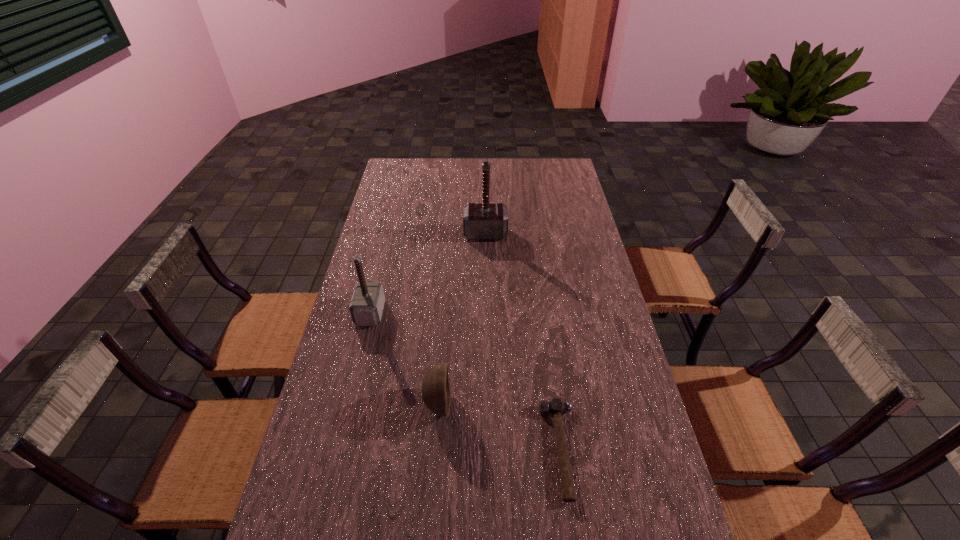
Image resolution: width=960 pixels, height=540 pixels. I want to click on hammer that is the second nearest to the shortest hammer, so click(483, 221).

Point out which hammer is positioned as the nearest to the third object from right to left. Please provide its 2D coordinates. Your answer should be formatted as a tuple, i.e. [(x, y)], where the tuple contains the x and y coordinates of a point satisfying the conditions above.

[(556, 407)]

At what (x,y) coordinates should I click in order to perform the action: click on free space that satisfies the following two spatial constraints: 1. for striking with the head of the third object from right to left; 2. on the left side of the second tallest object. Please return your answer as a coordinate pair (x, y). Looking at the image, I should click on (348, 403).

The image size is (960, 540). What are the coordinates of `vacant position in the image that satisfies the following two spatial constraints: 1. on the back side of the bowl; 2. for striking with the head of the leftmost hammer` in the screenshot? It's located at (445, 313).

Find the location of a particular element. This screenshot has width=960, height=540. free space that satisfies the following two spatial constraints: 1. for striking with the head of the leftmost object; 2. on the back side of the bowl is located at coordinates (348, 403).

Where is `free location that satisfies the following two spatial constraints: 1. for striking with the head of the second nearest hammer; 2. on the right side of the second object from left to right`? This screenshot has width=960, height=540. free location that satisfies the following two spatial constraints: 1. for striking with the head of the second nearest hammer; 2. on the right side of the second object from left to right is located at coordinates (348, 403).